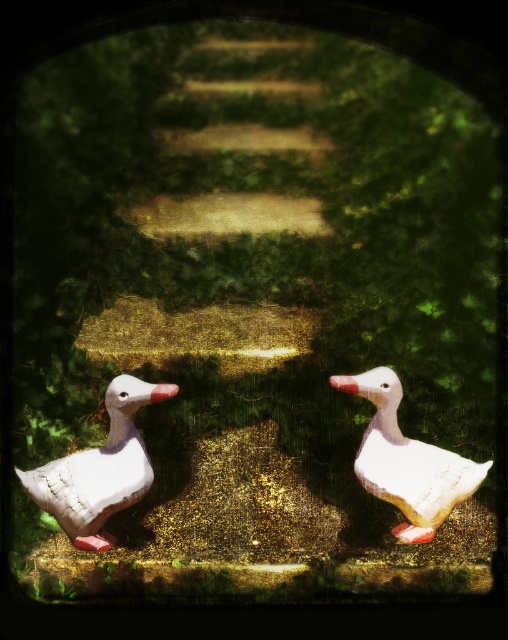
You are a small child who wants to place a third duck exactly halfway between the white matte duck at lower left and the white matte duck at center. What is the minimum distance you need to walk from the lower left duck to reach the halfway point?

The white matte duck at lower left is 13.51 inches from the white matte duck at center. To reach the halfway point, you need to walk 6.755 inches from the lower left duck.